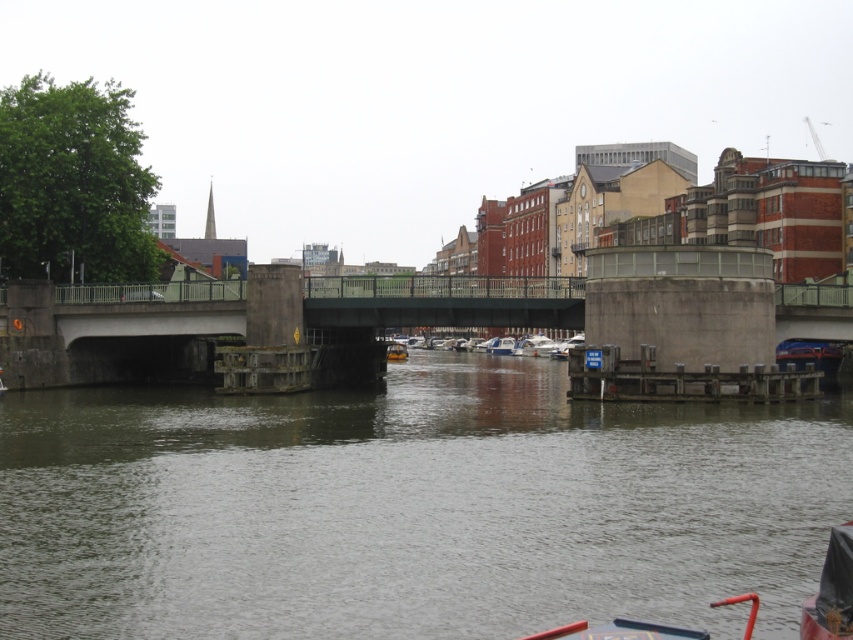
Which is behind, point (408, 339) or point (496, 349)?

Point (408, 339)

Based on the photo, who is more forward, [532,349] or [495,348]?

Point [532,349]

The image size is (853, 640). In order to click on white plastic boats at center in this screenshot , I will do `click(492, 342)`.

Who is more forward, (341, 408) or (509, 340)?

Positioned in front is point (341, 408).

Does smooth concrete water at center appear on the right side of white plastic boat at center?

Incorrect, smooth concrete water at center is not on the right side of white plastic boat at center.

Measure the distance between point (465, 432) and camera.

Point (465, 432) is 43.78 meters away from camera.

At what (x,y) coordinates should I click in order to perform the action: click on smooth concrete water at center. Please return your answer as a coordinate pair (x, y). The image size is (853, 640). Looking at the image, I should click on (409, 508).

Who is taller, white plastic boat at center or yellow rubber boat at center?

yellow rubber boat at center is taller.

In order to click on white plastic boat at center in this screenshot , I will do `click(502, 346)`.

Which is behind, point (503, 346) or point (402, 358)?

The point (503, 346) is behind.

I want to click on white plastic boat at center, so click(502, 346).